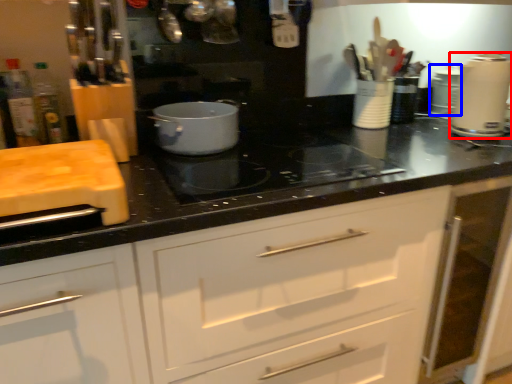
Question: Among these objects, which one is farthest to the camera, kitchen appliance (highlighted by a red box) or appliance (highlighted by a blue box)?

Choices:
 (A) kitchen appliance
 (B) appliance

Answer: (B)